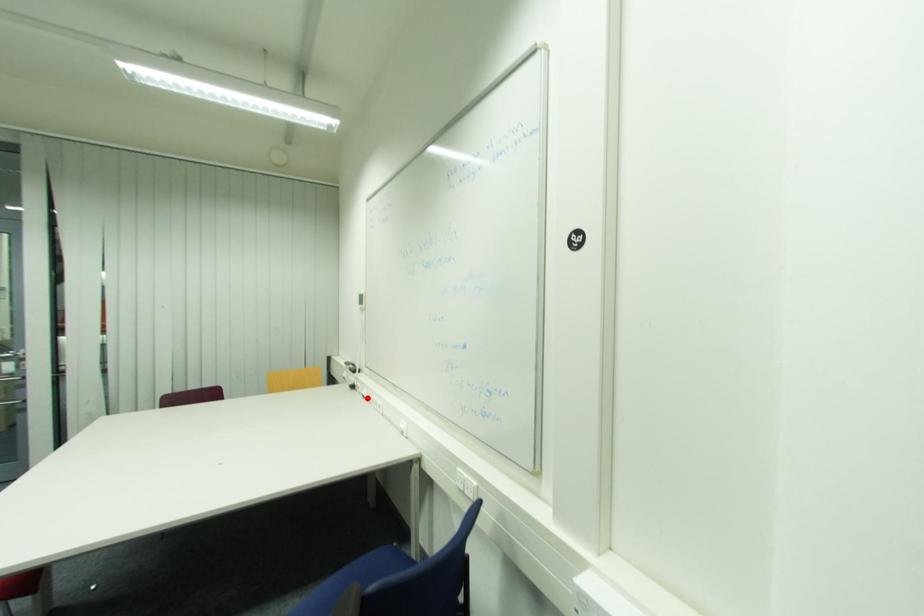
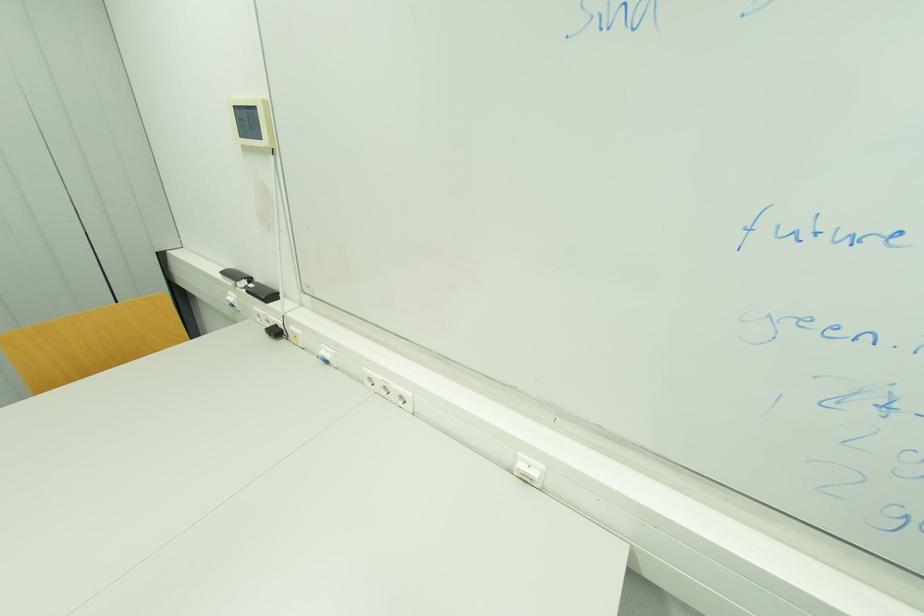
Locate, in the second image, the point that corresponds to the highlighted location in the first image.

(330, 362)